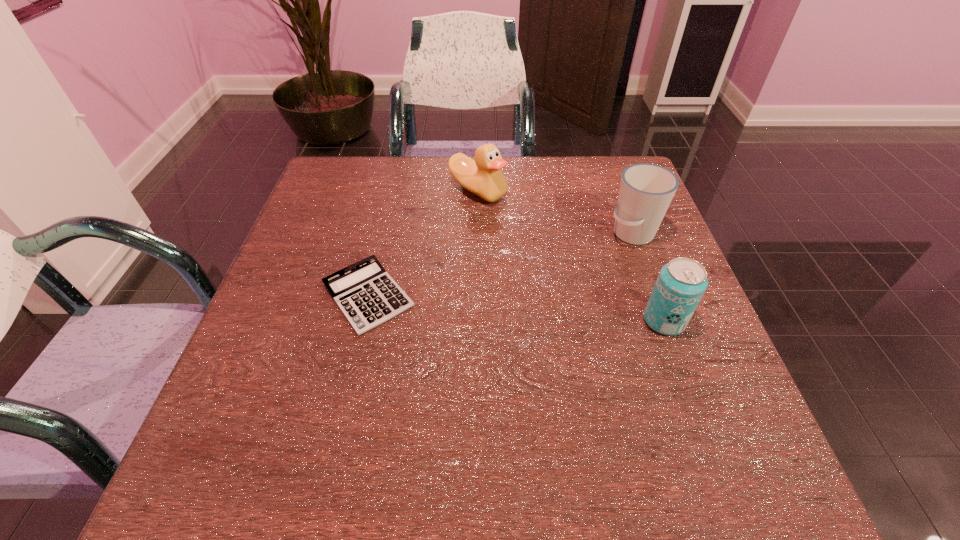
The height and width of the screenshot is (540, 960). I want to click on free space on the desktop that is between the shortest object and the beer can and is positioned with a handle on the side of the cup, so click(x=501, y=307).

You are a GUI agent. You are given a task and a screenshot of the screen. Output one action in this format:
    pyautogui.click(x=<x>, y=<y>)
    Task: Click on the free spot on the desktop that is between the leftmost object and the beer can and is positioned at the beak of the third object from right to left
    
    Given the screenshot: What is the action you would take?
    pyautogui.click(x=478, y=305)